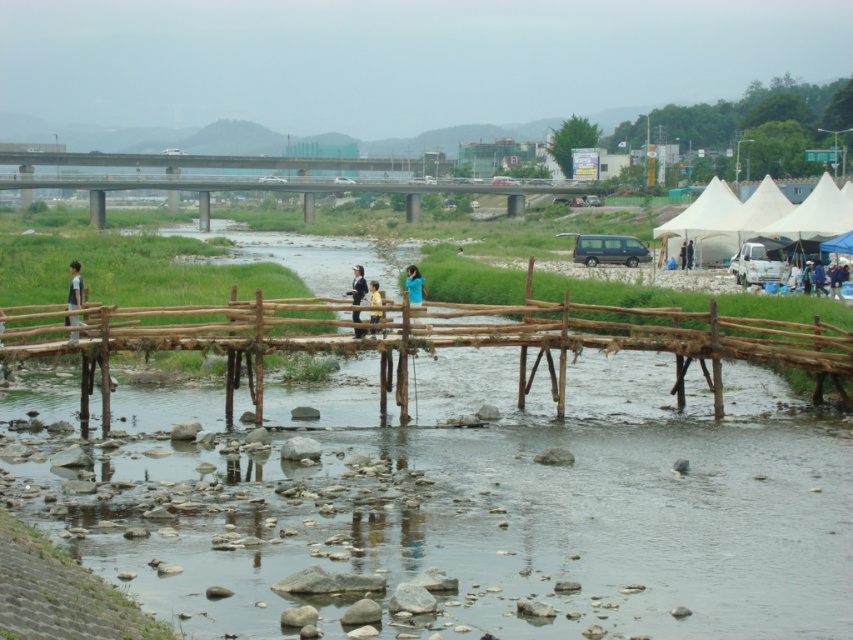
You are a delivery person carrying a heavy box and need to cross the rustic wooden bridge. There are two people on the bridge already. One is wearing a light blue shirt at left and the other is wearing a light blue fabric jacket at center. The bridge can only hold a maximum of 4 people at a time. Can you safely cross the bridge without exceeding its capacity?

The bridge can hold up to 4 people. Currently, there are 2 people on the bridge wearing the light blue shirt at left and the light blue fabric jacket at center. Since 2 people are already there, you can safely add yourself making it 3, which is under the 4 person limit. However, you must ensure no one else joins before you cross.

You are a hiker carrying a light blue fabric jacket at center and want to cross the natural wood bridge at center. Can you safely walk across the bridge while holding the jacket? Explain why based on their sizes.

The natural wood bridge at center is wider than the light blue fabric jacket at center. Since the bridge is wider, there should be enough space to walk across while holding the jacket safely.

You are a photographer planning to capture a photo of the light blue shirt at left and the light blue fabric jacket at center in the riverside scene. Since you want both items to appear the same size in the photo, which direction should you move your camera?

To make the light blue shirt at left and the light blue fabric jacket at center appear the same size in the photo, you should move the camera closer to the light blue fabric jacket at center since it is smaller and further away than the shirt.